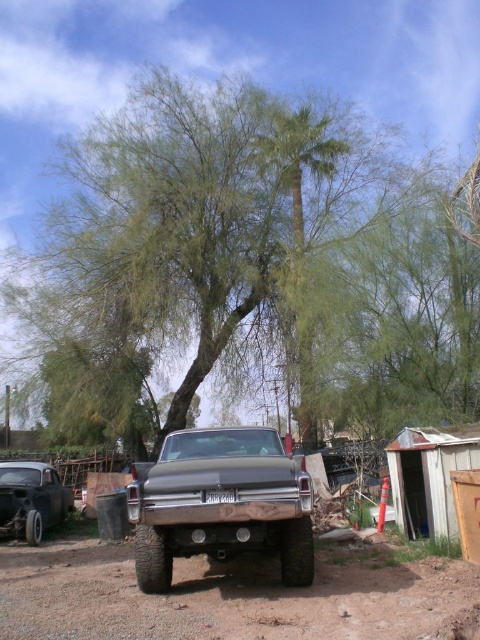
You are a delivery person who needs to park your vehicle near the vintage pickup truck. You see the green leafy tree at center and the rusty metal car at lower left. Which object is closer to the ground?

The rusty metal car at lower left is closer to the ground because the green leafy tree at center is located above it.

Consider the image. You are a photographer planning to take a photo of the green leafy tree at center and the rusty metal car at lower left. Based on the scene, which object is taller?

The green leafy tree at center is taller than the rusty metal car at lower left.